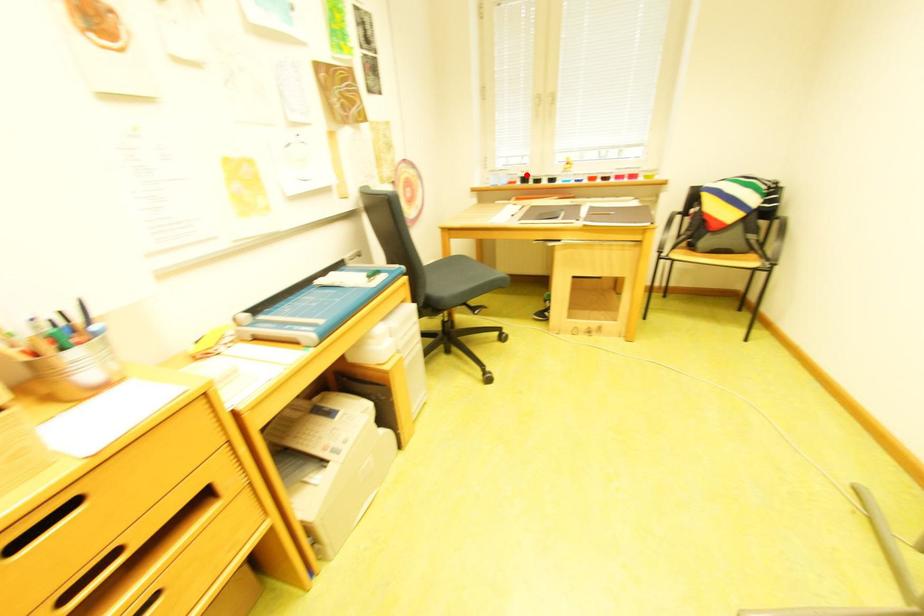
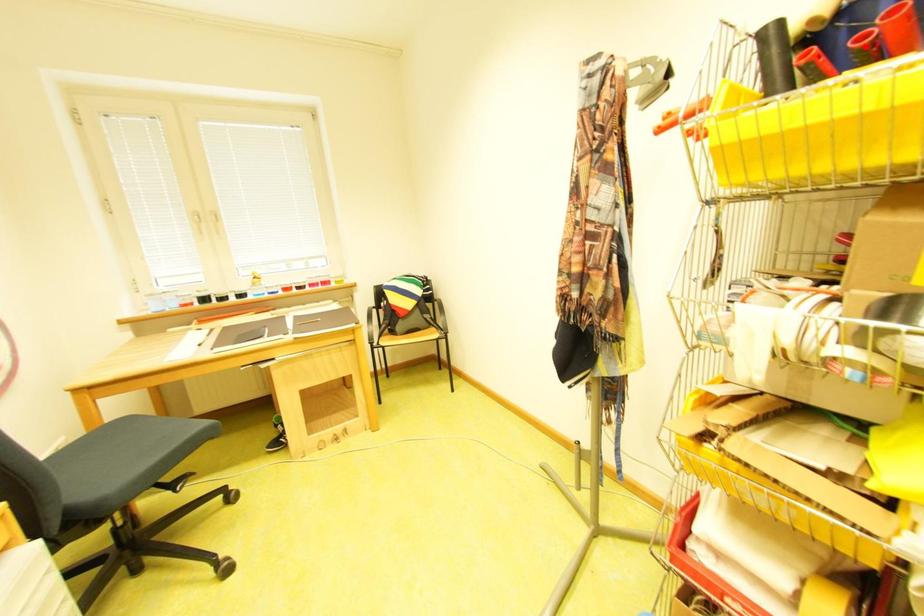
In the scene shown: I am providing you with two images of the same scene from different viewpoints. A red point is marked on the first image and another point is marked on the second image. Is the marked point in image1 the same physical position as the marked point in image2?

No